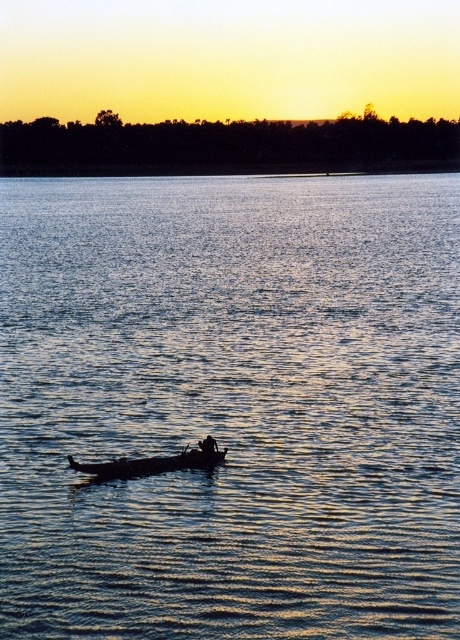
Question: Which of the following is the farthest from the observer?

Choices:
 (A) blue water at center
 (B) dark skin textured person at center

Answer: (B)

Question: Is blue water at center above wooden boat at center?

Choices:
 (A) no
 (B) yes

Answer: (B)

Question: Considering the relative positions of blue water at center and dark skin textured person at center in the image provided, where is blue water at center located with respect to dark skin textured person at center?

Choices:
 (A) below
 (B) above

Answer: (B)

Question: Which of these objects is positioned closest to the dark skin textured person at center?

Choices:
 (A) blue water at center
 (B) wooden boat at center

Answer: (B)

Question: Does blue water at center appear over wooden boat at center?

Choices:
 (A) no
 (B) yes

Answer: (B)

Question: Estimate the real-world distances between objects in this image. Which object is farther from the blue water at center?

Choices:
 (A) wooden boat at center
 (B) dark skin textured person at center

Answer: (B)